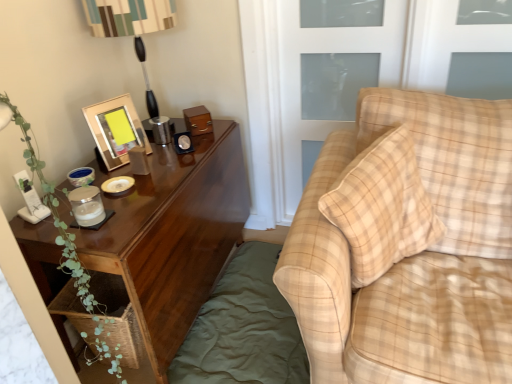
Question: Is wooden table lamp at upper left located outside green cotton bedding at lower left?

Choices:
 (A) yes
 (B) no

Answer: (A)

Question: Is green cotton bedding at lower left inside wooden table lamp at upper left?

Choices:
 (A) yes
 (B) no

Answer: (B)

Question: Is wooden table lamp at upper left at the left side of green cotton bedding at lower left?

Choices:
 (A) yes
 (B) no

Answer: (A)

Question: Does wooden table lamp at upper left have a smaller size compared to green cotton bedding at lower left?

Choices:
 (A) no
 (B) yes

Answer: (A)

Question: Would you say wooden table lamp at upper left is a long distance from green cotton bedding at lower left?

Choices:
 (A) no
 (B) yes

Answer: (B)

Question: Looking at the image, does green leafy plant at left seem bigger or smaller compared to wooden table lamp at upper left?

Choices:
 (A) small
 (B) big

Answer: (A)

Question: Is green leafy plant at left in front of or behind wooden table lamp at upper left in the image?

Choices:
 (A) front
 (B) behind

Answer: (A)

Question: From the image's perspective, is green leafy plant at left above or below wooden table lamp at upper left?

Choices:
 (A) below
 (B) above

Answer: (A)

Question: From a real-world perspective, relative to wooden table lamp at upper left, is green leafy plant at left vertically above or below?

Choices:
 (A) below
 (B) above

Answer: (A)

Question: Is transparent glass door at upper right wider or thinner than woodenobject at upper left?

Choices:
 (A) thin
 (B) wide

Answer: (A)

Question: Looking at the image, does transparent glass door at upper right seem bigger or smaller compared to woodenobject at upper left?

Choices:
 (A) small
 (B) big

Answer: (B)

Question: Is transparent glass door at upper right inside the boundaries of woodenobject at upper left, or outside?

Choices:
 (A) inside
 (B) outside

Answer: (B)

Question: Is transparent glass door at upper right in front of or behind woodenobject at upper left in the image?

Choices:
 (A) behind
 (B) front

Answer: (A)

Question: Is green cotton bedding at lower left to the left or to the right of plaid fabric couch at right in the image?

Choices:
 (A) left
 (B) right

Answer: (A)

Question: Looking at their shapes, would you say green cotton bedding at lower left is wider or thinner than plaid fabric couch at right?

Choices:
 (A) wide
 (B) thin

Answer: (B)